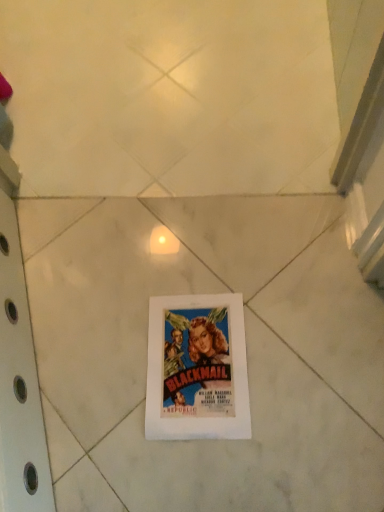
Question: Do you think white paper at center is within white paper at center, or outside of it?

Choices:
 (A) inside
 (B) outside

Answer: (B)

Question: Considering the positions of white paper at center and white paper at center in the image, is white paper at center taller or shorter than white paper at center?

Choices:
 (A) tall
 (B) short

Answer: (A)

Question: From a real-world perspective, is white paper at center physically located above or below white paper at center?

Choices:
 (A) above
 (B) below

Answer: (B)

Question: Choose the correct answer: Is white paper at center inside white paper at center or outside it?

Choices:
 (A) outside
 (B) inside

Answer: (B)

Question: In the image, is white paper at center on the left side or the right side of white paper at center?

Choices:
 (A) right
 (B) left

Answer: (A)

Question: Relative to white paper at center, is white paper at center in front or behind?

Choices:
 (A) behind
 (B) front

Answer: (A)

Question: Is point (185, 387) closer or farther from the camera than point (72, 291)?

Choices:
 (A) closer
 (B) farther

Answer: (A)